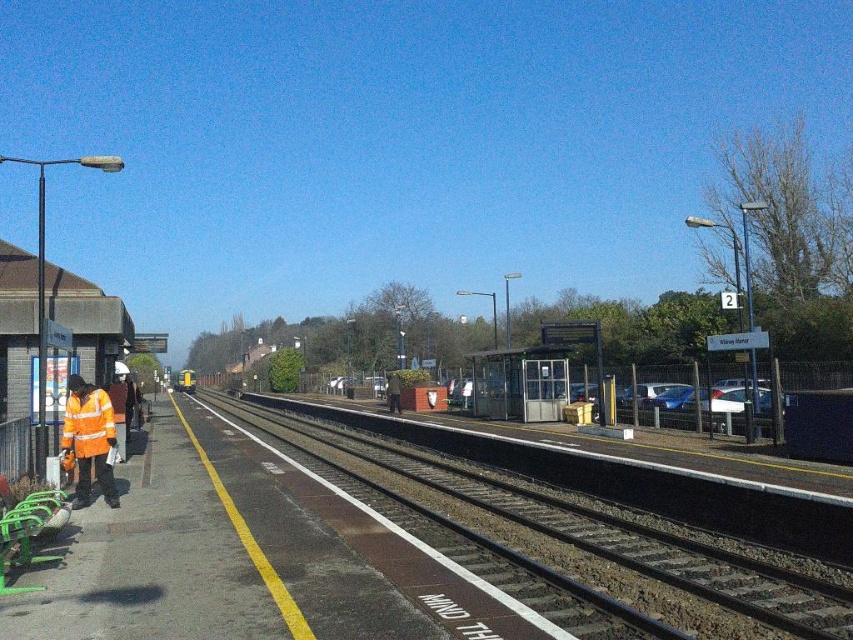
Question: Can you confirm if black asphalt track at center is positioned below high-visibility orange jacket at left?

Choices:
 (A) yes
 (B) no

Answer: (A)

Question: Can you confirm if black asphalt track at center is thinner than high visibility orange safety vest at left?

Choices:
 (A) no
 (B) yes

Answer: (A)

Question: Does black asphalt track at center come in front of high-visibility orange jacket at left?

Choices:
 (A) yes
 (B) no

Answer: (A)

Question: Considering the real-world distances, which object is farthest from the high visibility orange safety vest at left?

Choices:
 (A) high-visibility orange jacket at left
 (B) black asphalt track at center

Answer: (B)

Question: Based on their relative distances, which object is farther from the high-visibility orange jacket at left?

Choices:
 (A) black asphalt track at center
 (B) high visibility orange safety vest at left

Answer: (A)

Question: Which point appears farthest from the camera in this image?

Choices:
 (A) (113, 488)
 (B) (795, 556)

Answer: (A)